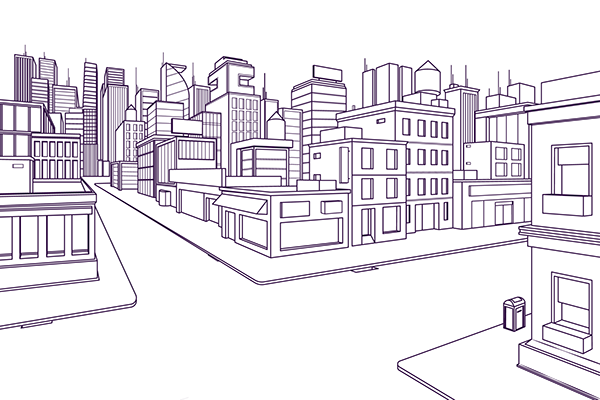
The height and width of the screenshot is (400, 600). Identify the location of glass window. (577, 177), (576, 312).